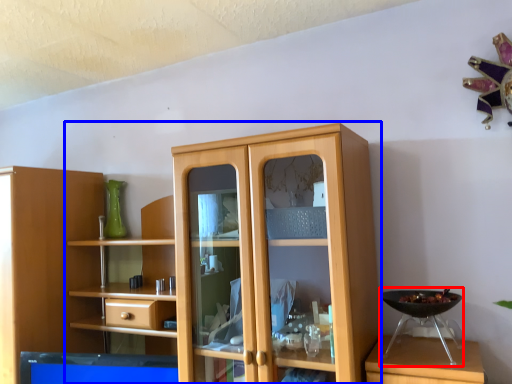
Question: Among these objects, which one is nearest to the camera, appliance (highlighted by a red box) or cupboard (highlighted by a blue box)?

Choices:
 (A) appliance
 (B) cupboard

Answer: (B)